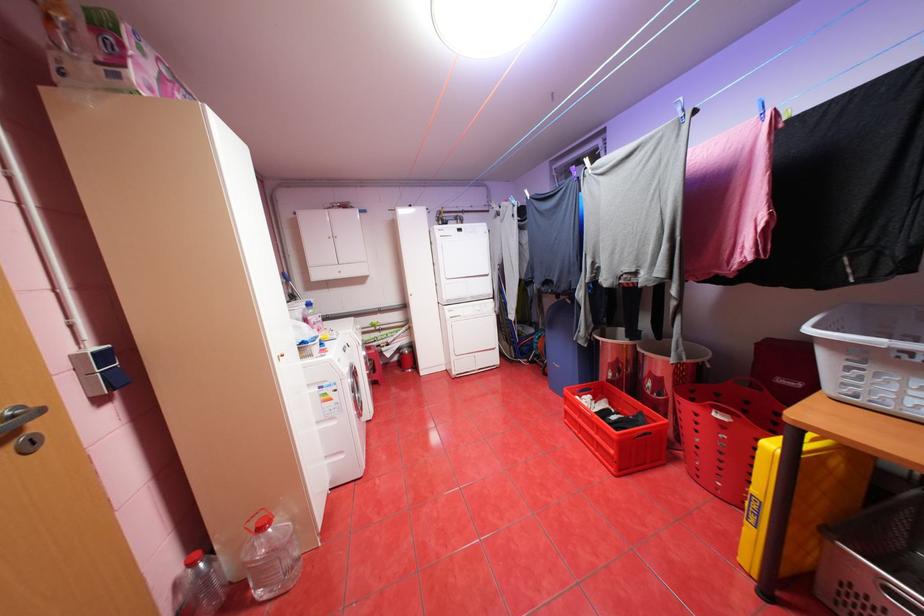
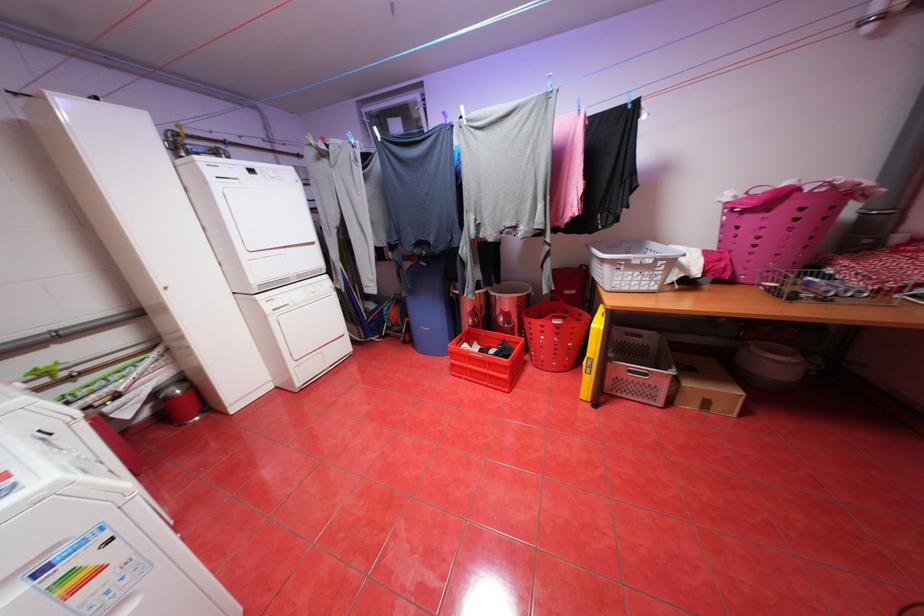
Question: The camera is either moving clockwise (left) or counter-clockwise (right) around the object. The first image is from the beginning of the video and the second image is from the end. Is the camera moving left or right when shooting the video?

Choices:
 (A) Left
 (B) Right

Answer: (A)